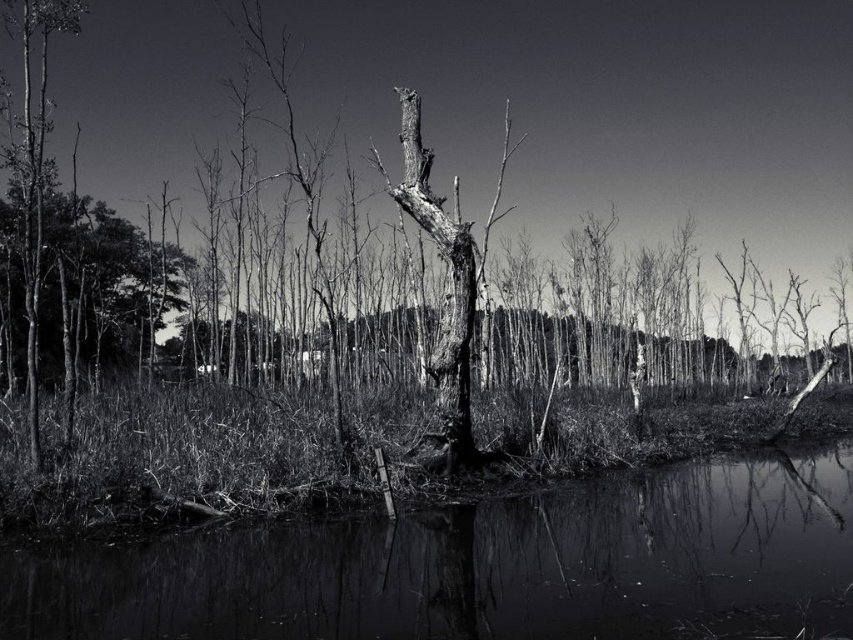
You are a photographer trying to capture the reflection of the large, gnarled tree in the smooth water at center. Based on the scene, where should you position your camera to ensure the reflection is fully visible?

The smooth water at center is located at point [485,566] in 2D coordinates, so position the camera directly above or facing that point to capture the reflection of the large, gnarled tree.

You are a photographer who wants to capture the reflection of the smooth bark tree at center in the smooth water at center. Given that your camera can only focus on objects within 10 meters, will you be able to capture the reflection clearly?

The smooth water at center and smooth bark tree at center are 8.66 meters apart from each other. Since the camera can focus within 10 meters, the distance of 8.66 meters is within range, so yes, you can capture the reflection clearly.

You are an environmental scientist assessing the health of this forest. You observe the smooth bark tree at center and the smooth bark tree at left. Which tree is more likely to be younger based on their sizes?

The smooth bark tree at center is smaller than the smooth bark tree at left, so it is more likely to be younger.